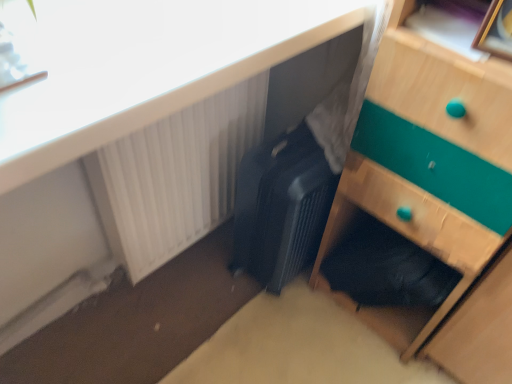
Question: Should I look upward or downward to see wooden picture frame at upper right?

Choices:
 (A) down
 (B) up

Answer: (B)

Question: From a real-world perspective, is wooden chest of drawers at lower right under white plastic radiator at upper left?

Choices:
 (A) yes
 (B) no

Answer: (B)

Question: Considering the relative sizes of wooden chest of drawers at lower right and white plastic radiator at upper left in the image provided, is wooden chest of drawers at lower right wider than white plastic radiator at upper left?

Choices:
 (A) no
 (B) yes

Answer: (B)

Question: Considering the relative sizes of wooden chest of drawers at lower right and white plastic radiator at upper left in the image provided, is wooden chest of drawers at lower right smaller than white plastic radiator at upper left?

Choices:
 (A) no
 (B) yes

Answer: (A)

Question: Can you confirm if wooden chest of drawers at lower right is shorter than white plastic radiator at upper left?

Choices:
 (A) yes
 (B) no

Answer: (B)

Question: Does wooden chest of drawers at lower right turn towards white plastic radiator at upper left?

Choices:
 (A) yes
 (B) no

Answer: (B)

Question: Is wooden chest of drawers at lower right not inside white plastic radiator at upper left?

Choices:
 (A) no
 (B) yes

Answer: (B)

Question: Is wooden chest of drawers at lower right located within wooden picture frame at upper right?

Choices:
 (A) no
 (B) yes

Answer: (A)

Question: Could you tell me if wooden picture frame at upper right is facing wooden chest of drawers at lower right?

Choices:
 (A) no
 (B) yes

Answer: (B)

Question: Is the depth of wooden picture frame at upper right greater than that of wooden chest of drawers at lower right?

Choices:
 (A) yes
 (B) no

Answer: (A)

Question: From the image's perspective, is wooden picture frame at upper right below wooden chest of drawers at lower right?

Choices:
 (A) yes
 (B) no

Answer: (B)

Question: Is wooden picture frame at upper right at the left side of wooden chest of drawers at lower right?

Choices:
 (A) no
 (B) yes

Answer: (B)

Question: Considering the relative sizes of wooden picture frame at upper right and wooden chest of drawers at lower right in the image provided, is wooden picture frame at upper right wider than wooden chest of drawers at lower right?

Choices:
 (A) no
 (B) yes

Answer: (A)

Question: Is matte black suitcase at center surrounded by white plastic radiator at upper left?

Choices:
 (A) yes
 (B) no

Answer: (B)